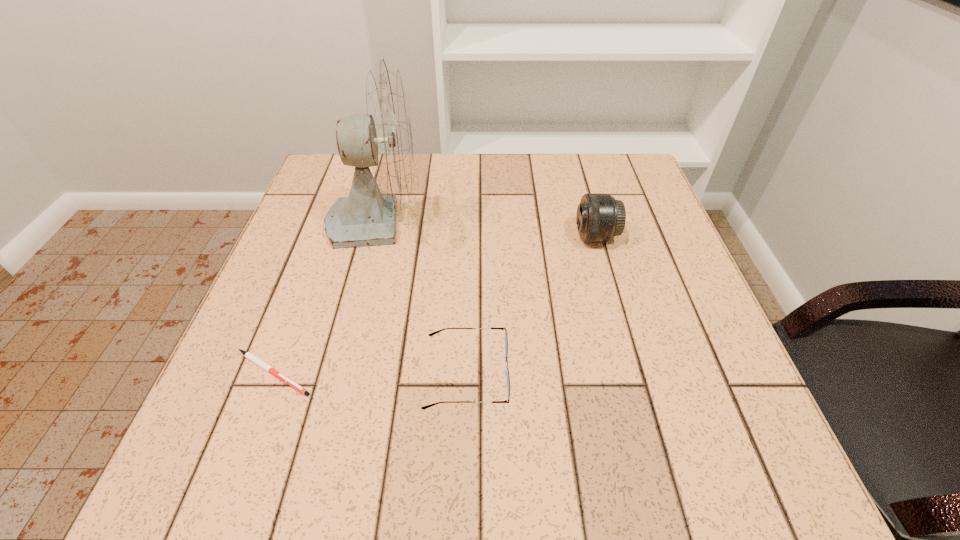
In the image, there is a desktop. Where is `free space at the right edge`? free space at the right edge is located at coordinates (643, 252).

Where is `vacant space at the far right corner`? This screenshot has height=540, width=960. vacant space at the far right corner is located at coordinates (593, 188).

This screenshot has height=540, width=960. I want to click on vacant space that's between the shortest object and the third shortest object, so click(434, 305).

Locate an element on the screen. The width and height of the screenshot is (960, 540). vacant space that is in between the tallest object and the second shortest object is located at coordinates (421, 297).

At what (x,y) coordinates should I click in order to perform the action: click on free space between the pen and the telephoto lens. Please return your answer as a coordinate pair (x, y). Looking at the image, I should click on (434, 305).

At what (x,y) coordinates should I click in order to perform the action: click on free spot between the tallest object and the third tallest object. Please return your answer as a coordinate pair (x, y). The height and width of the screenshot is (540, 960). Looking at the image, I should click on (421, 297).

You are a GUI agent. You are given a task and a screenshot of the screen. Output one action in this format:
    pyautogui.click(x=<x>, y=<y>)
    Task: Click on the empty space between the tallest object and the spectacles
    The image size is (960, 540).
    Given the screenshot: What is the action you would take?
    pyautogui.click(x=421, y=297)

Identify the location of vacant space that is in between the rightmost object and the third object from left to right. This screenshot has height=540, width=960. (531, 305).

At what (x,y) coordinates should I click in order to perform the action: click on vacant space that is in between the spectacles and the telephoto lens. Please return your answer as a coordinate pair (x, y). The image size is (960, 540). Looking at the image, I should click on (531, 305).

At what (x,y) coordinates should I click in order to perform the action: click on vacant space in between the tallest object and the shortest object. Please return your answer as a coordinate pair (x, y). This screenshot has width=960, height=540. Looking at the image, I should click on (324, 296).